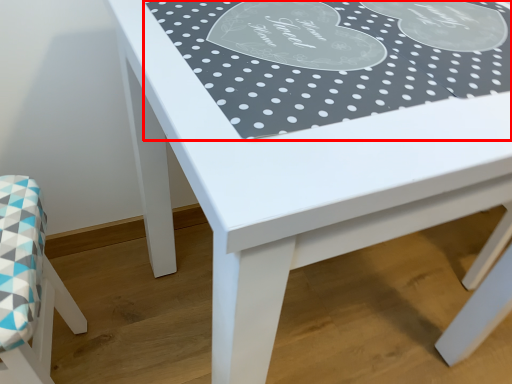
Question: Where is tablecloth (annotated by the red box) located in relation to chair in the image?

Choices:
 (A) right
 (B) left

Answer: (A)